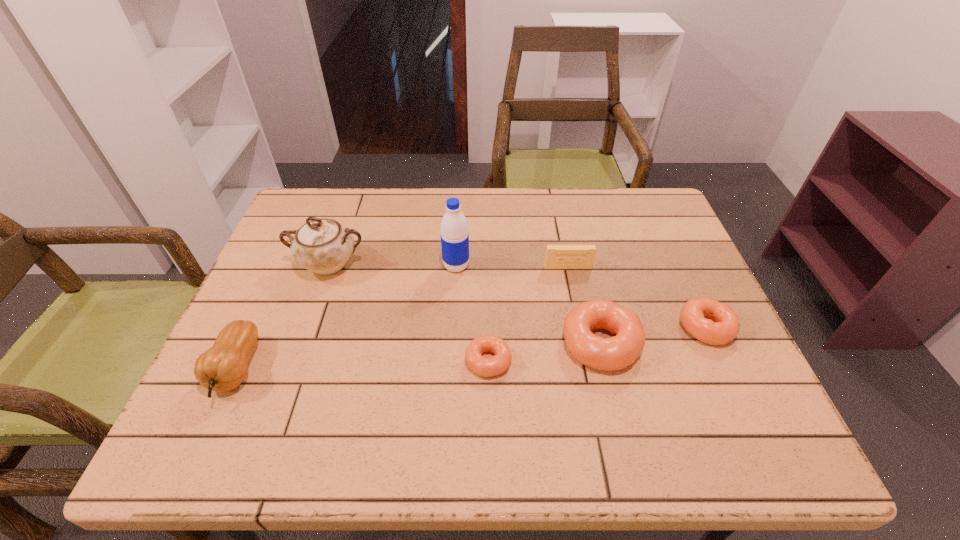
This screenshot has width=960, height=540. What are the coordinates of `vacant space in between the fifth shortest object and the water bottle` in the screenshot? It's located at (347, 318).

Where is `unoccupied area between the second shortest doughnut and the videotape`? The image size is (960, 540). unoccupied area between the second shortest doughnut and the videotape is located at coordinates (636, 298).

Identify the location of free space between the sixth shortest object and the water bottle. (393, 265).

The height and width of the screenshot is (540, 960). I want to click on free spot between the videotape and the third tallest object, so click(402, 318).

At what (x,y) coordinates should I click in order to perform the action: click on object that is the closest one to the tallest doughnut. Please return your answer as a coordinate pair (x, y). This screenshot has width=960, height=540. Looking at the image, I should click on (723, 325).

Where is `object that ranks as the fifth closest to the sixth shortest object`? Image resolution: width=960 pixels, height=540 pixels. object that ranks as the fifth closest to the sixth shortest object is located at coordinates (607, 354).

Identify which doughnut is the second closest to the shortest doughnut. Please provide its 2D coordinates. Your answer should be formatted as a tuple, i.e. [(x, y)], where the tuple contains the x and y coordinates of a point satisfying the conditions above.

[(723, 325)]

Where is `doughnut object that ranks as the second closest to the chinaware`? doughnut object that ranks as the second closest to the chinaware is located at coordinates (607, 354).

Where is `vacant space that satisfies the following two spatial constraints: 1. at the front of the second tallest doughnut with spools; 2. on the right side of the videotape`? This screenshot has height=540, width=960. vacant space that satisfies the following two spatial constraints: 1. at the front of the second tallest doughnut with spools; 2. on the right side of the videotape is located at coordinates (580, 327).